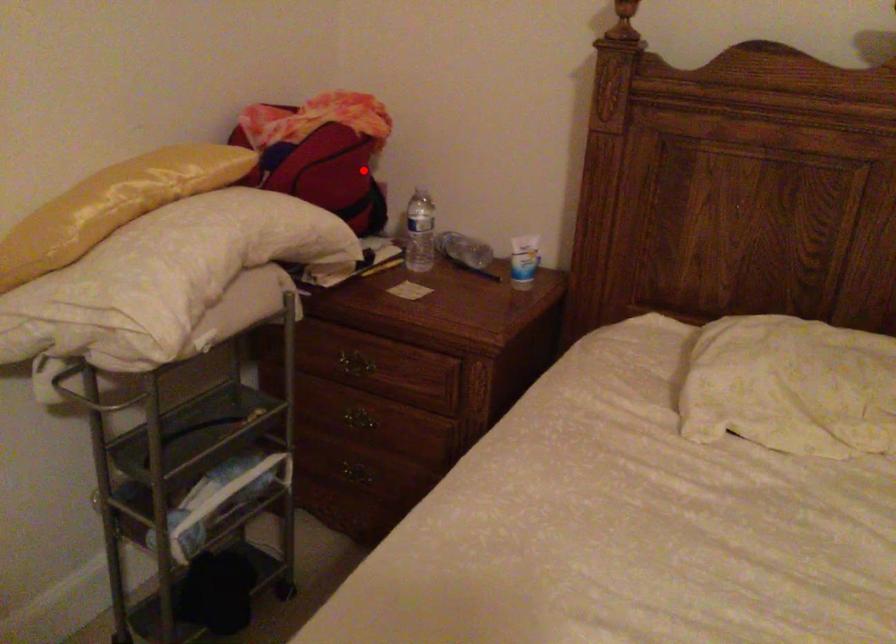
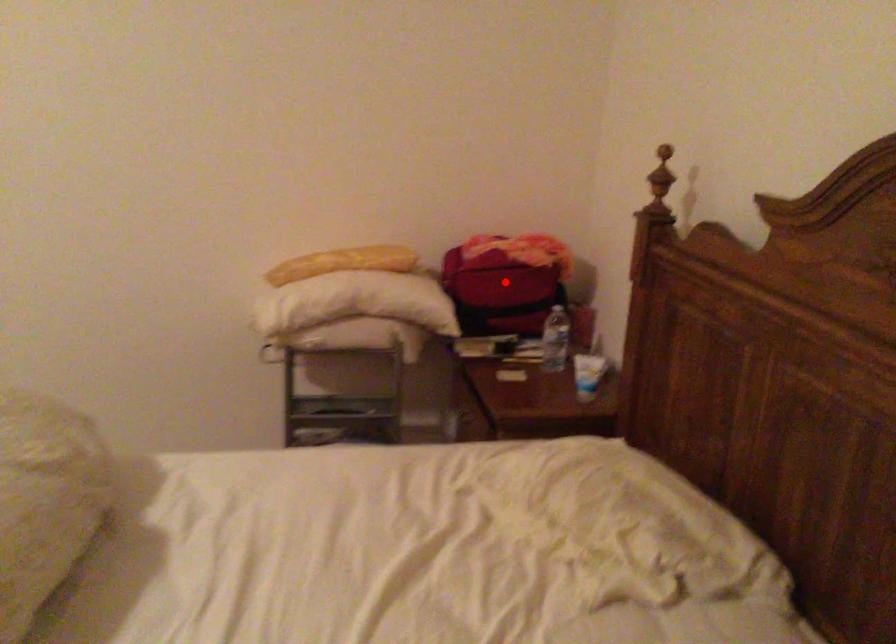
I am providing you with two images of the same scene from different viewpoints. A red point is marked on the first image and another point is marked on the second image. Is the marked point in image1 the same physical position as the marked point in image2?

Yes